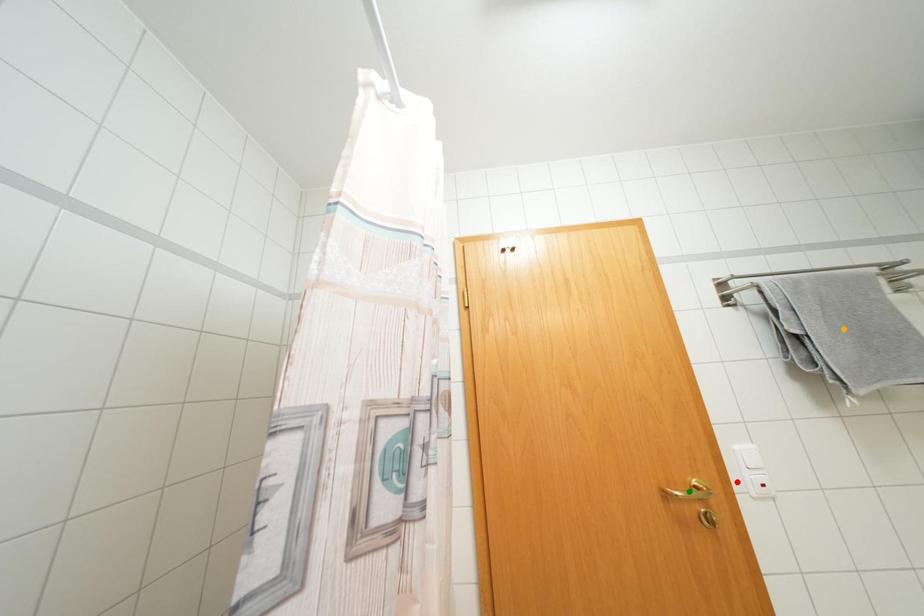
Order these from farthest to nearest:
A) red point
B) orange point
C) green point

orange point → red point → green point